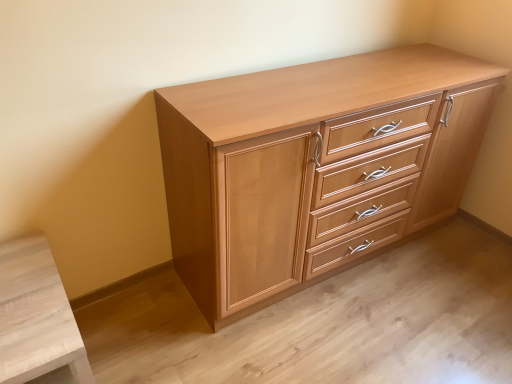
Question: In terms of size, does light brown wood chest of drawers at center appear bigger or smaller than light wood cabinet at lower left?

Choices:
 (A) big
 (B) small

Answer: (A)

Question: From the image's perspective, is light brown wood chest of drawers at center above or below light wood cabinet at lower left?

Choices:
 (A) below
 (B) above

Answer: (B)

Question: Is light brown wood chest of drawers at center taller or shorter than light wood cabinet at lower left?

Choices:
 (A) short
 (B) tall

Answer: (B)

Question: In the image, is light wood cabinet at lower left on the left side or the right side of light brown wood chest of drawers at center?

Choices:
 (A) left
 (B) right

Answer: (A)

Question: From a real-world perspective, is light wood cabinet at lower left positioned above or below light brown wood chest of drawers at center?

Choices:
 (A) above
 (B) below

Answer: (B)

Question: Is light wood cabinet at lower left wider or thinner than light brown wood chest of drawers at center?

Choices:
 (A) thin
 (B) wide

Answer: (B)

Question: Choose the correct answer: Is light wood cabinet at lower left inside light brown wood chest of drawers at center or outside it?

Choices:
 (A) inside
 (B) outside

Answer: (B)